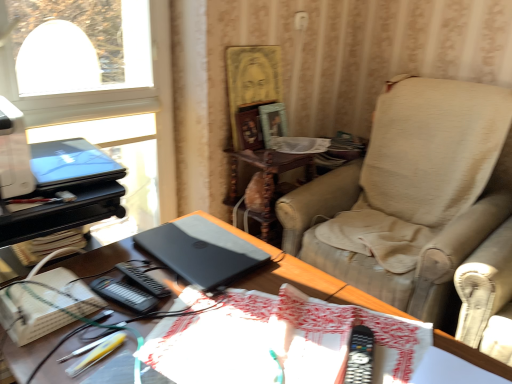
Question: From a real-world perspective, relative to matte black laptop at upper left, the 2th laptop positioned from the bottom, is white cardboard book at lower left vertically above or below?

Choices:
 (A) below
 (B) above

Answer: (A)

Question: Relative to matte black laptop at upper left, which is counted as the 1th laptop, starting from the top, is white cardboard book at lower left in front or behind?

Choices:
 (A) behind
 (B) front

Answer: (B)

Question: Estimate the real-world distances between objects in this image. Which object is farther from the beige fabric chair at right?

Choices:
 (A) wooden side table at center
 (B) black plastic remote control at lower right
 (C) white cardboard book at lower left
 (D) wooden picture frame at center, acting as the 2th picture frame starting from the right
 (E) matte black laptop at upper left, the first laptop when ordered from left to right

Answer: (C)

Question: Which object is positioned farthest from the matte black laptop at upper left, the first laptop when ordered from left to right?

Choices:
 (A) wooden side table at center
 (B) beige fabric chair at right
 (C) matte wooden picture frame at upper center, which ranks as the first picture frame in right-to-left order
 (D) black plastic remote control at lower right
 (E) matte black laptop at center, which is counted as the first laptop, starting from the right

Answer: (B)